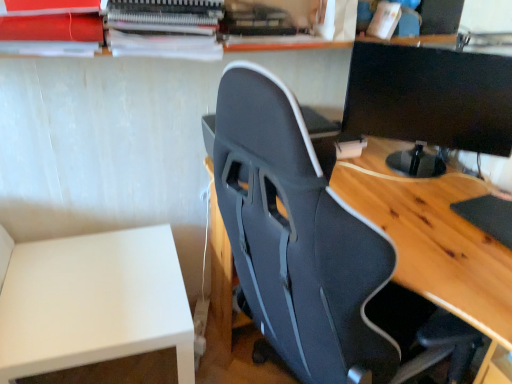
Question: Is black glossy monitor at upper right smaller than white matte table at lower left?

Choices:
 (A) no
 (B) yes

Answer: (B)

Question: From the image's perspective, is black glossy monitor at upper right above white matte table at lower left?

Choices:
 (A) no
 (B) yes

Answer: (B)

Question: From a real-world perspective, is black glossy monitor at upper right over white matte table at lower left?

Choices:
 (A) yes
 (B) no

Answer: (A)

Question: Does black glossy monitor at upper right have a lesser width compared to white matte table at lower left?

Choices:
 (A) yes
 (B) no

Answer: (A)

Question: Would you consider black glossy monitor at upper right to be distant from white matte table at lower left?

Choices:
 (A) yes
 (B) no

Answer: (A)

Question: From the image's perspective, does black glossy monitor at upper right appear lower than white matte table at lower left?

Choices:
 (A) yes
 (B) no

Answer: (B)

Question: From the image's perspective, is black fabric chair at center located beneath black glossy monitor at upper right?

Choices:
 (A) no
 (B) yes

Answer: (B)

Question: Can we say black fabric chair at center lies outside black glossy monitor at upper right?

Choices:
 (A) yes
 (B) no

Answer: (A)

Question: Is black fabric chair at center facing towards black glossy monitor at upper right?

Choices:
 (A) no
 (B) yes

Answer: (A)

Question: Is black fabric chair at center behind black glossy monitor at upper right?

Choices:
 (A) yes
 (B) no

Answer: (B)

Question: Is black fabric chair at center wider than black glossy monitor at upper right?

Choices:
 (A) no
 (B) yes

Answer: (B)

Question: Are black fabric chair at center and black glossy monitor at upper right far apart?

Choices:
 (A) yes
 (B) no

Answer: (B)

Question: Is black glossy monitor at upper right located outside black fabric chair at center?

Choices:
 (A) yes
 (B) no

Answer: (A)